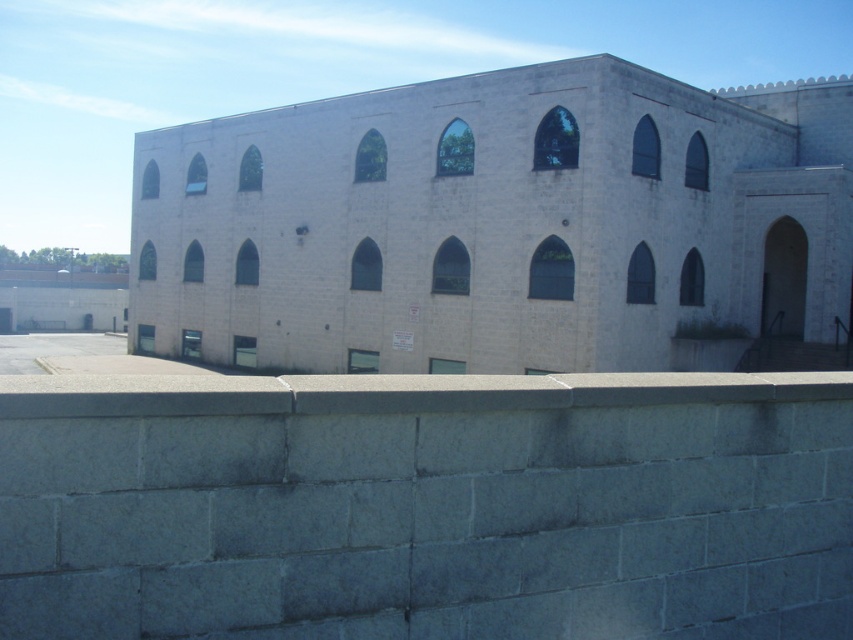
Between white stone church at center and gray concrete ledge at center, which one appears on the left side from the viewer's perspective?

From the viewer's perspective, white stone church at center appears more on the left side.

Where is `white stone church at center`? This screenshot has height=640, width=853. white stone church at center is located at coordinates (500, 225).

Which is behind, point (849, 189) or point (666, 388)?

Positioned behind is point (849, 189).

You are a GUI agent. You are given a task and a screenshot of the screen. Output one action in this format:
    pyautogui.click(x=<x>, y=<y>)
    Task: Click on the white stone church at center
    The image size is (853, 640).
    Given the screenshot: What is the action you would take?
    pyautogui.click(x=500, y=225)

Is gray concrete ledge at lower center shorter than white stone church at center?

Indeed, gray concrete ledge at lower center has a lesser height compared to white stone church at center.

Between gray concrete ledge at lower center and white stone church at center, which one appears on the left side from the viewer's perspective?

Positioned to the left is white stone church at center.

Identify the location of gray concrete ledge at lower center. (426, 506).

Locate an element on the screen. The height and width of the screenshot is (640, 853). gray concrete ledge at lower center is located at coordinates (426, 506).

Is gray concrete ledge at lower center further to the viewer compared to gray concrete ledge at center?

No.

Find the location of `gray concrete ledge at lower center`. gray concrete ledge at lower center is located at coordinates pos(426,506).

You are a GUI agent. You are given a task and a screenshot of the screen. Output one action in this format:
    pyautogui.click(x=<x>, y=<y>)
    Task: Click on the gray concrete ledge at lower center
    The image size is (853, 640).
    Given the screenshot: What is the action you would take?
    point(426,506)